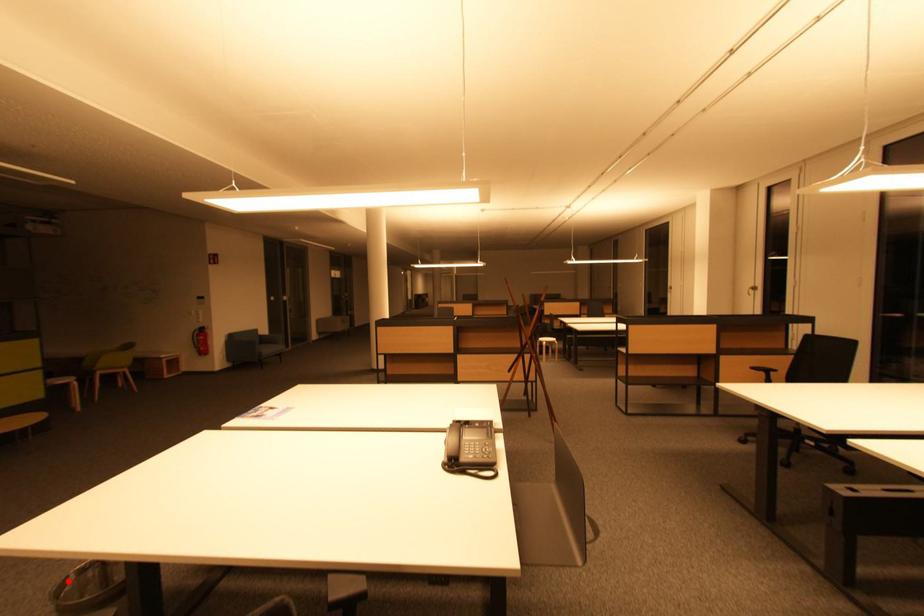
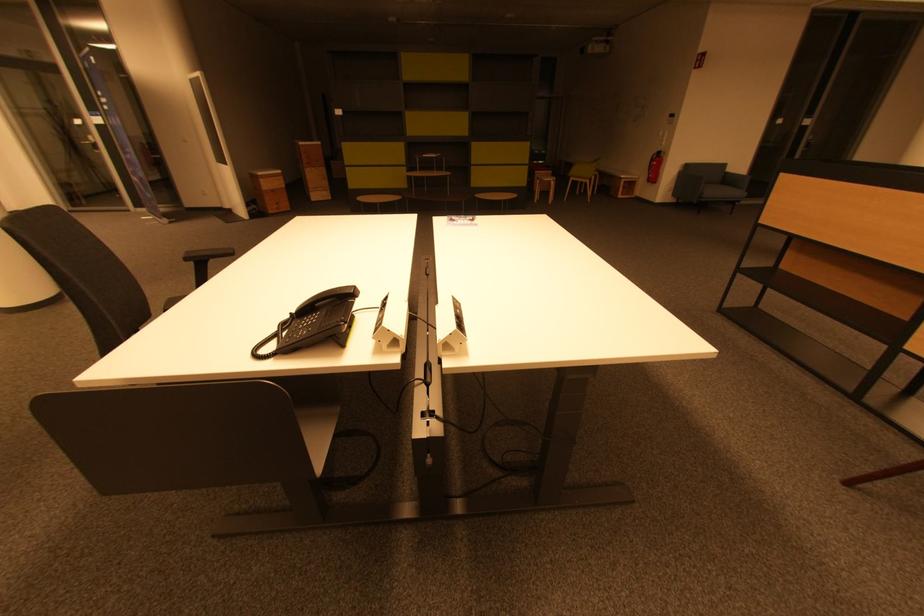
Question: I am providing you with two images of the same scene from different viewpoints. A red point is marked on the first image. Can you still see the location of the red point in image 2?

Choices:
 (A) Yes
 (B) No

Answer: (B)